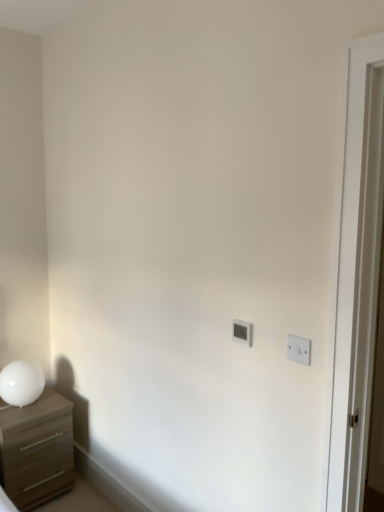
This screenshot has width=384, height=512. What do you see at coordinates (36, 449) in the screenshot?
I see `matte brown chest of drawers at left` at bounding box center [36, 449].

What do you see at coordinates (299, 349) in the screenshot?
I see `white plastic light switch at upper right, which is the 2th light switch in back-to-front order` at bounding box center [299, 349].

You are a GUI agent. You are given a task and a screenshot of the screen. Output one action in this format:
    pyautogui.click(x=<x>, y=<y>)
    Task: Click on the matte brown chest of drawers at left
    The height and width of the screenshot is (512, 384).
    Given the screenshot: What is the action you would take?
    pyautogui.click(x=36, y=449)

Locate an element on the screen. Image resolution: width=384 pixels, height=512 pixels. table lamp below the white plastic light switch at upper right, marked as the first light switch in a right-to-left arrangement (from the image's perspective) is located at coordinates (21, 383).

Is white glossy table lamp at left positioned far away from white plastic light switch at upper right, marked as the first light switch in a right-to-left arrangement?

white glossy table lamp at left is positioned a significant distance from white plastic light switch at upper right, marked as the first light switch in a right-to-left arrangement.

Is white glossy table lamp at left in front of white plastic light switch at upper right, the first light switch when ordered from front to back?

No, it is not.

From the image's perspective, relative to white plastic light switch at upper right, which is the 2th light switch in back-to-front order, is white glossy table lamp at left above or below?

white glossy table lamp at left is situated lower than white plastic light switch at upper right, which is the 2th light switch in back-to-front order, in the image.

Is white plastic light switch at center, the first light switch when ordered from back to front, positioned with its back to white glossy table lamp at left?

No, white plastic light switch at center, the first light switch when ordered from back to front,'s orientation is not away from white glossy table lamp at left.

From the image's perspective, is white plastic light switch at center, the first light switch when ordered from back to front, over white glossy table lamp at left?

Yes, from the image's perspective, white plastic light switch at center, the first light switch when ordered from back to front, is on top of white glossy table lamp at left.

Which light switch is the 1st one when counting from the front of the white glossy table lamp at left? Please provide its 2D coordinates.

[(242, 332)]

Considering the positions of objects white plastic light switch at center, the first light switch when ordered from back to front, and white glossy table lamp at left in the image provided, who is more to the right, white plastic light switch at center, the first light switch when ordered from back to front, or white glossy table lamp at left?

white plastic light switch at center, the first light switch when ordered from back to front.

Identify the location of chest of drawers below the white glossy table lamp at left (from a real-world perspective). This screenshot has width=384, height=512. (36, 449).

From a real-world perspective, is white glossy table lamp at left beneath matte brown chest of drawers at left?

Actually, white glossy table lamp at left is physically above matte brown chest of drawers at left in the real world.

Considering the sizes of objects white glossy table lamp at left and matte brown chest of drawers at left in the image provided, who is thinner, white glossy table lamp at left or matte brown chest of drawers at left?

white glossy table lamp at left is thinner.

Can you confirm if white glossy table lamp at left is positioned to the right of matte brown chest of drawers at left?

No, white glossy table lamp at left is not to the right of matte brown chest of drawers at left.

Looking at this image, is matte brown chest of drawers at left at the back of white plastic light switch at upper right, marked as the first light switch in a right-to-left arrangement?

No.

In the scene shown: Does white plastic light switch at upper right, which is the 2th light switch in back-to-front order, have a smaller size compared to matte brown chest of drawers at left?

Correct, white plastic light switch at upper right, which is the 2th light switch in back-to-front order, occupies less space than matte brown chest of drawers at left.

Is white plastic light switch at upper right, marked as the first light switch in a right-to-left arrangement, not near matte brown chest of drawers at left?

Yes, white plastic light switch at upper right, marked as the first light switch in a right-to-left arrangement, and matte brown chest of drawers at left are located far from each other.

How different are the orientations of white plastic light switch at upper right, the first light switch when ordered from front to back, and matte brown chest of drawers at left in degrees?

white plastic light switch at upper right, the first light switch when ordered from front to back, and matte brown chest of drawers at left are facing 91.5 degrees away from each other.

This screenshot has width=384, height=512. What are the coordinates of `table lamp that is under the white plastic light switch at center, positioned as the 1th light switch in left-to-right order (from a real-world perspective)` in the screenshot? It's located at (21, 383).

How different are the orientations of white glossy table lamp at left and white plastic light switch at center, the first light switch when ordered from back to front, in degrees?

The angular difference between white glossy table lamp at left and white plastic light switch at center, the first light switch when ordered from back to front, is 91.5 degrees.

Could you tell me if white glossy table lamp at left is turned towards white plastic light switch at center, positioned as the 1th light switch in left-to-right order?

Yes, white glossy table lamp at left is oriented towards white plastic light switch at center, positioned as the 1th light switch in left-to-right order.

Between white glossy table lamp at left and white plastic light switch at center, positioned as the 1th light switch in left-to-right order, which one has larger size?

white glossy table lamp at left is bigger.

From a real-world perspective, is matte brown chest of drawers at left above or below white plastic light switch at center, positioned as the 1th light switch in left-to-right order?

In terms of real-world spatial position, matte brown chest of drawers at left is below white plastic light switch at center, positioned as the 1th light switch in left-to-right order.

Is matte brown chest of drawers at left not near white plastic light switch at center, the first light switch when ordered from back to front?

Absolutely, matte brown chest of drawers at left is distant from white plastic light switch at center, the first light switch when ordered from back to front.

Can you tell me how much matte brown chest of drawers at left and white plastic light switch at center, arranged as the second light switch when viewed from the right, differ in facing direction?

There is a 91.5-degree angle between the facing directions of matte brown chest of drawers at left and white plastic light switch at center, arranged as the second light switch when viewed from the right.

Can you confirm if matte brown chest of drawers at left is smaller than white plastic light switch at center, the first light switch when ordered from back to front?

Actually, matte brown chest of drawers at left might be larger than white plastic light switch at center, the first light switch when ordered from back to front.

Is the position of white plastic light switch at upper right, which is the 2th light switch in back-to-front order, more distant than that of white glossy table lamp at left?

No, it is in front of white glossy table lamp at left.

From the image's perspective, is white plastic light switch at upper right, the first light switch when ordered from front to back, located above or below white glossy table lamp at left?

Based on their image positions, white plastic light switch at upper right, the first light switch when ordered from front to back, is located above white glossy table lamp at left.

Does white plastic light switch at upper right, which appears as the second light switch when viewed from the left, have a greater height compared to white glossy table lamp at left?

No, white plastic light switch at upper right, which appears as the second light switch when viewed from the left, is not taller than white glossy table lamp at left.

Between white plastic light switch at upper right, marked as the first light switch in a right-to-left arrangement, and white glossy table lamp at left, which one has smaller width?

white plastic light switch at upper right, marked as the first light switch in a right-to-left arrangement.

From a real-world perspective, which light switch is the 2nd one above the white glossy table lamp at left? Please provide its 2D coordinates.

[(299, 349)]

The width and height of the screenshot is (384, 512). Identify the location of table lamp that is below the white plastic light switch at center, the first light switch when ordered from back to front (from the image's perspective). 21,383.

Estimate the real-world distances between objects in this image. Which object is closer to matte brown chest of drawers at left, white plastic light switch at upper right, the first light switch when ordered from front to back, or white plastic light switch at center, the first light switch when ordered from back to front?

Among the two, white plastic light switch at center, the first light switch when ordered from back to front, is located nearer to matte brown chest of drawers at left.

Based on their spatial positions, is white plastic light switch at upper right, marked as the first light switch in a right-to-left arrangement, or matte brown chest of drawers at left further from white plastic light switch at center, arranged as the second light switch when viewed from the right?

matte brown chest of drawers at left.

Based on their spatial positions, is white plastic light switch at center, which appears as the second light switch when viewed from the front, or white glossy table lamp at left further from white plastic light switch at upper right, which is the 2th light switch in back-to-front order?

white glossy table lamp at left is further to white plastic light switch at upper right, which is the 2th light switch in back-to-front order.

When comparing their distances from white glossy table lamp at left, does matte brown chest of drawers at left or white plastic light switch at upper right, marked as the first light switch in a right-to-left arrangement, seem further?

white plastic light switch at upper right, marked as the first light switch in a right-to-left arrangement.

Estimate the real-world distances between objects in this image. Which object is closer to white glossy table lamp at left, white plastic light switch at upper right, marked as the first light switch in a right-to-left arrangement, or white plastic light switch at center, positioned as the 1th light switch in left-to-right order?

Based on the image, white plastic light switch at center, positioned as the 1th light switch in left-to-right order, appears to be nearer to white glossy table lamp at left.

Considering their positions, is white glossy table lamp at left positioned further to white plastic light switch at upper right, the first light switch when ordered from front to back, than white plastic light switch at center, which appears as the second light switch when viewed from the front?

white glossy table lamp at left lies further to white plastic light switch at upper right, the first light switch when ordered from front to back, than the other object.

When comparing their distances from white plastic light switch at center, the first light switch when ordered from back to front, does matte brown chest of drawers at left or white glossy table lamp at left seem further?

Based on the image, matte brown chest of drawers at left appears to be further to white plastic light switch at center, the first light switch when ordered from back to front.

When comparing their distances from white plastic light switch at upper right, which appears as the second light switch when viewed from the left, does white glossy table lamp at left or matte brown chest of drawers at left seem further?

The object further to white plastic light switch at upper right, which appears as the second light switch when viewed from the left, is matte brown chest of drawers at left.

This screenshot has width=384, height=512. In order to click on light switch between matte brown chest of drawers at left and white plastic light switch at upper right, the first light switch when ordered from front to back in this screenshot , I will do `click(242, 332)`.

Where is `chest of drawers between white glossy table lamp at left and white plastic light switch at upper right, marked as the first light switch in a right-to-left arrangement`? The image size is (384, 512). chest of drawers between white glossy table lamp at left and white plastic light switch at upper right, marked as the first light switch in a right-to-left arrangement is located at coordinates (36, 449).

Find the location of a particular element. The height and width of the screenshot is (512, 384). chest of drawers between white glossy table lamp at left and white plastic light switch at center, arranged as the second light switch when viewed from the right, from left to right is located at coordinates (36, 449).

Locate an element on the screen. This screenshot has width=384, height=512. light switch situated between white glossy table lamp at left and white plastic light switch at upper right, which appears as the second light switch when viewed from the left, from left to right is located at coordinates coord(242,332).